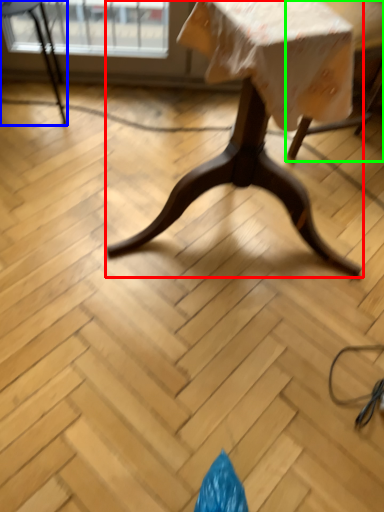
Question: Which object is the farthest from table (highlighted by a red box)? Choose among these: chair (highlighted by a blue box) or swivel chair (highlighted by a green box).

Choices:
 (A) chair
 (B) swivel chair

Answer: (A)